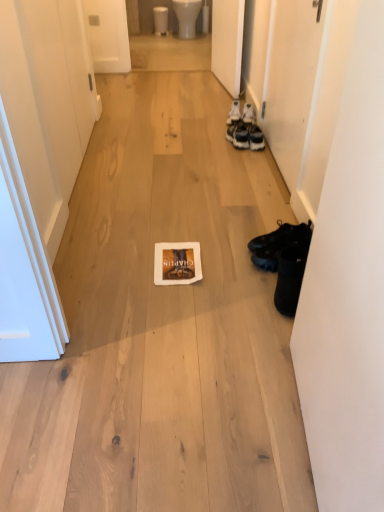
Where is `vacant space that is to the left of white matte door at right, acting as the third door starting from the left`? This screenshot has height=512, width=384. vacant space that is to the left of white matte door at right, acting as the third door starting from the left is located at coordinates (189, 159).